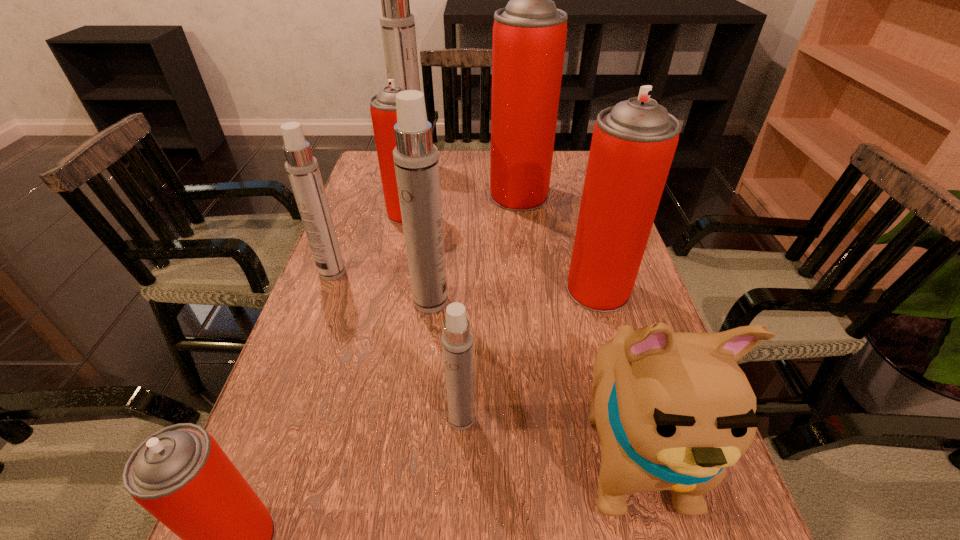
The image size is (960, 540). In order to click on blank space at the far edge of the desktop in this screenshot , I will do `click(466, 180)`.

I want to click on vacant space at the left edge of the desktop, so click(x=380, y=320).

Image resolution: width=960 pixels, height=540 pixels. In order to click on free space at the right edge of the desktop in this screenshot , I will do `click(732, 530)`.

In the image, there is a desktop. At what (x,y) coordinates should I click in order to perform the action: click on vacant space at the far right corner. Please return your answer as a coordinate pair (x, y). Looking at the image, I should click on (579, 187).

Image resolution: width=960 pixels, height=540 pixels. I want to click on vacant region between the leftmost white aerosol can and the third farthest white aerosol can, so click(x=382, y=287).

Identify the location of blank region between the leftmost white aerosol can and the smallest white aerosol can. (397, 346).

Where is `the seventh closest object relative to the rightmost white aerosol can`? The height and width of the screenshot is (540, 960). the seventh closest object relative to the rightmost white aerosol can is located at coordinates (529, 35).

Select which object is the closest to the third farthest red aerosol can. Please provide its 2D coordinates. Your answer should be formatted as a tuple, i.e. [(x, y)], where the tuple contains the x and y coordinates of a point satisfying the conditions above.

[(672, 410)]

You are a GUI agent. You are given a task and a screenshot of the screen. Output one action in this format:
    pyautogui.click(x=<x>, y=<y>)
    Task: Click on the aerosol can that stands as the seventh closest to the third smallest white aerosol can
    Image resolution: width=960 pixels, height=540 pixels.
    Given the screenshot: What is the action you would take?
    pyautogui.click(x=397, y=24)

Choose which aerosol can is the fourth nearest neighbor to the puppy. Please provide its 2D coordinates. Your answer should be formatted as a tuple, i.e. [(x, y)], where the tuple contains the x and y coordinates of a point satisfying the conditions above.

[(179, 474)]